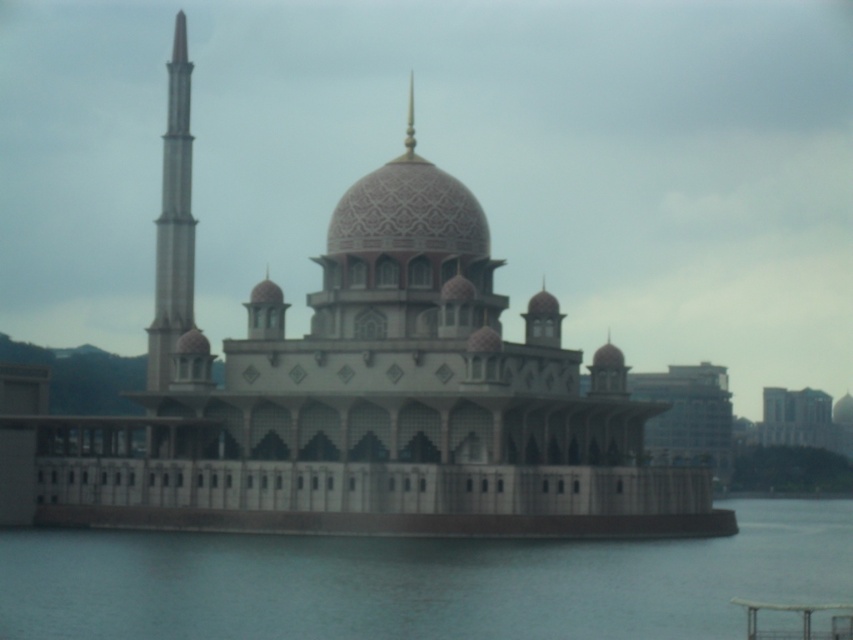
You are a boat captain navigating a small boat that is 3 meters wide. You want to pass between the clear water at lower center and the smooth concrete minaret at left. Can your boat fit through the gap?

The gap between the clear water at lower center and the smooth concrete minaret at left is 26.55 meters. Since your boat is only 3 meters wide, it can easily pass through the gap without any issues.

You are a photographer standing at the edge of the water, aiming to capture the mosque in your shot. You notice two points marked on your camera screen at coordinates point (315, 580) and point (177, 259). Which point should you focus on first if you want to ensure the closest part of the mosque is in sharp focus?

You should focus on point (315, 580) first because it is closer to the camera than point (177, 259), making it the nearest part of the mosque in the frame.

You are standing on the platform of the mosque and want to walk towards the water. Which object will you pass first, the clear water at lower center or the smooth concrete minaret at left?

You will pass the clear water at lower center first because it is in front of the smooth concrete minaret at left, meaning it is closer to you as you move toward the water.